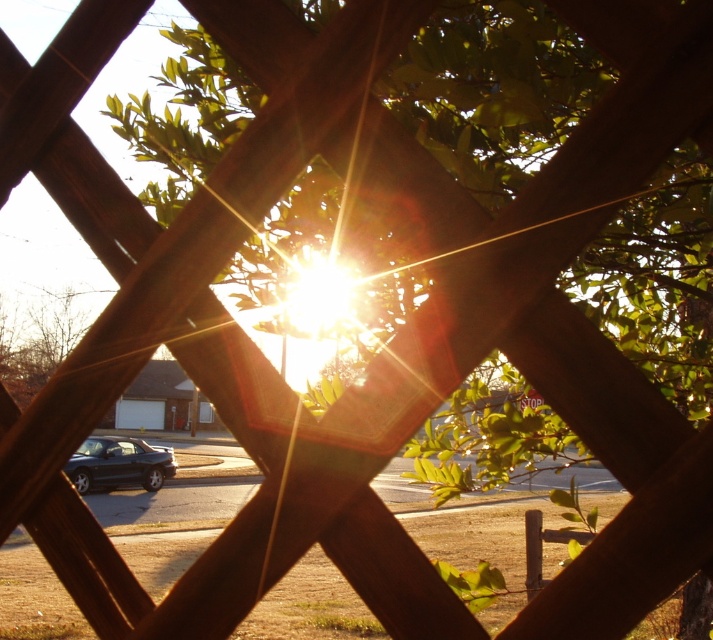
You are a delivery driver trying to see if you can spot both the shiny black car at center and the metallic silver stop sign at center through the wooden lattice fence. Which object is taller?

The shiny black car at center is taller than the metallic silver stop sign at center.

You are standing in front of the wooden lattice fence and want to park your car in the driveway behind the fence. The driveway is at point 0.725, 0.167. Can you see the shiny black car at center from your current position?

Yes, the shiny black car at center is located at point (118, 464), so you can see it from your current position in front of the wooden lattice fence.